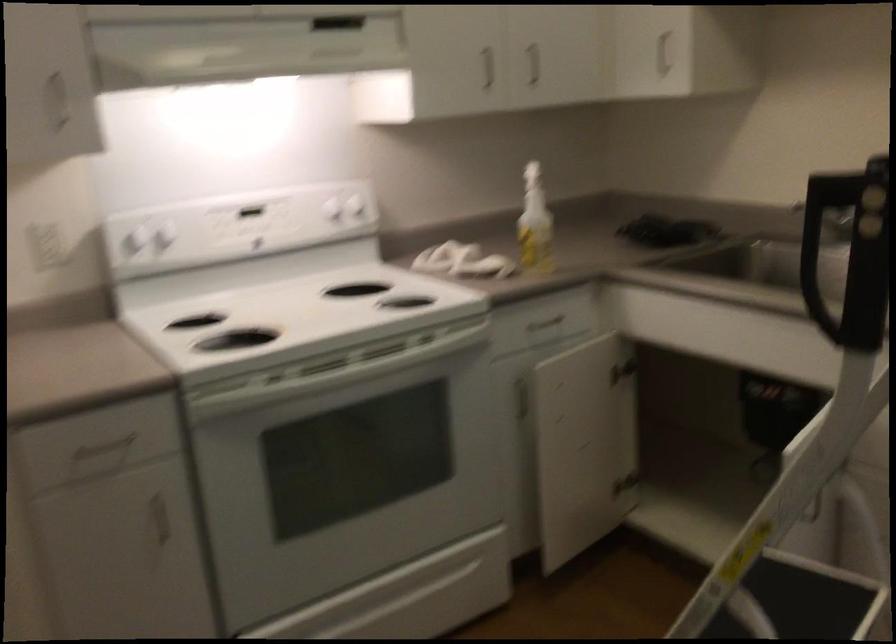
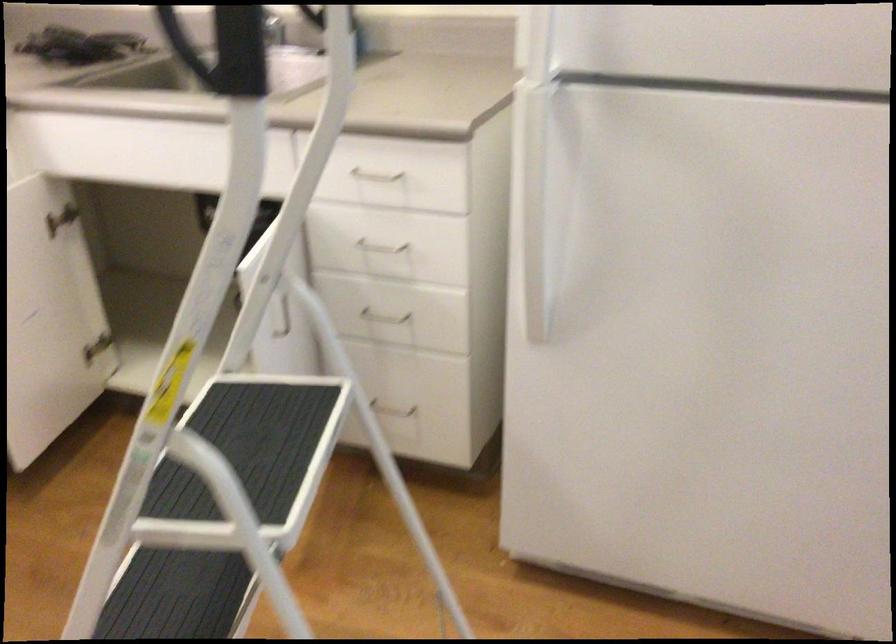
Find the pixel in the second image that matches [812,294] in the first image.

(186, 49)